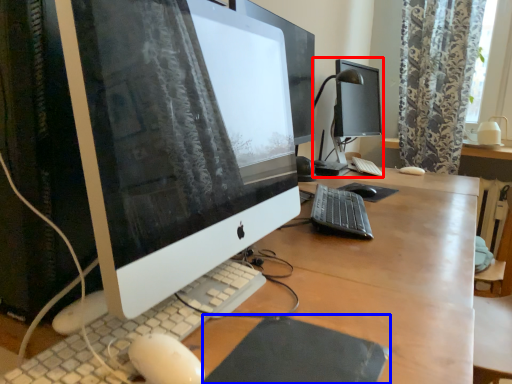
Question: Which point is further to the camera, desktop computer (highlighted by a red box) or mousepad (highlighted by a blue box)?

Choices:
 (A) desktop computer
 (B) mousepad

Answer: (A)